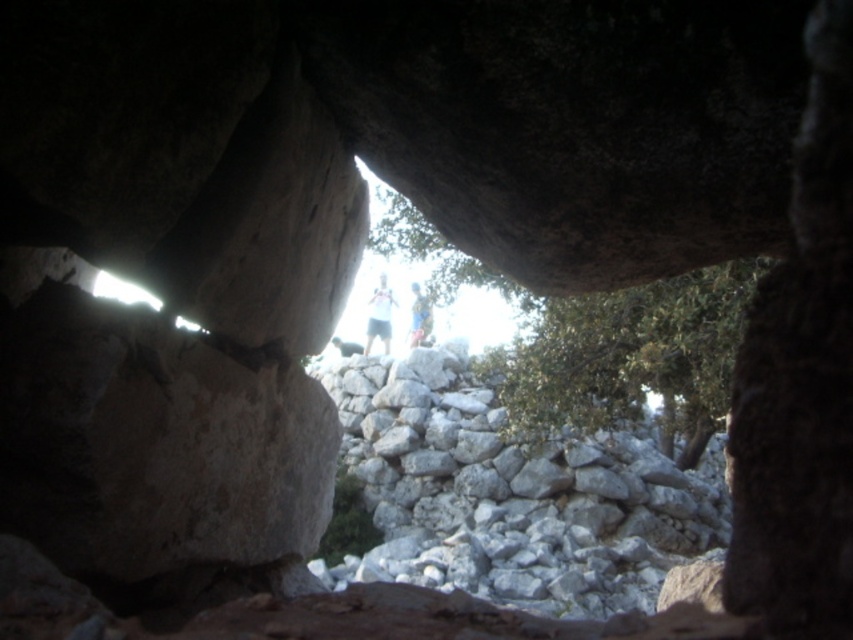
You are standing inside the cave and want to reach the white cotton shirt at center. There is a green leafy tree at center blocking your path. Can you walk around the tree to get to the shirt without going through the tree?

The green leafy tree at center is 4.90 meters away from the white cotton shirt at center, so you can walk around the tree to reach the shirt as they are not directly overlapping.

You are standing inside the rocky overhang and want to reach both the green leafy tree at center and the blue fabric at center. Which object will you encounter first as you exit the cave?

The green leafy tree at center will be encountered first because it is closer to the viewer than the blue fabric at center.

You are standing inside the cave and want to exit to the bright area outside. The gray rough stone wall at center is blocking your path. Can you walk around it to exit the cave?

The gray rough stone wall at center is 6.98 meters away from viewer. Since it is a wall, it likely extends beyond the visible area, so you may need to find another path around it or go through the cave entrance instead.